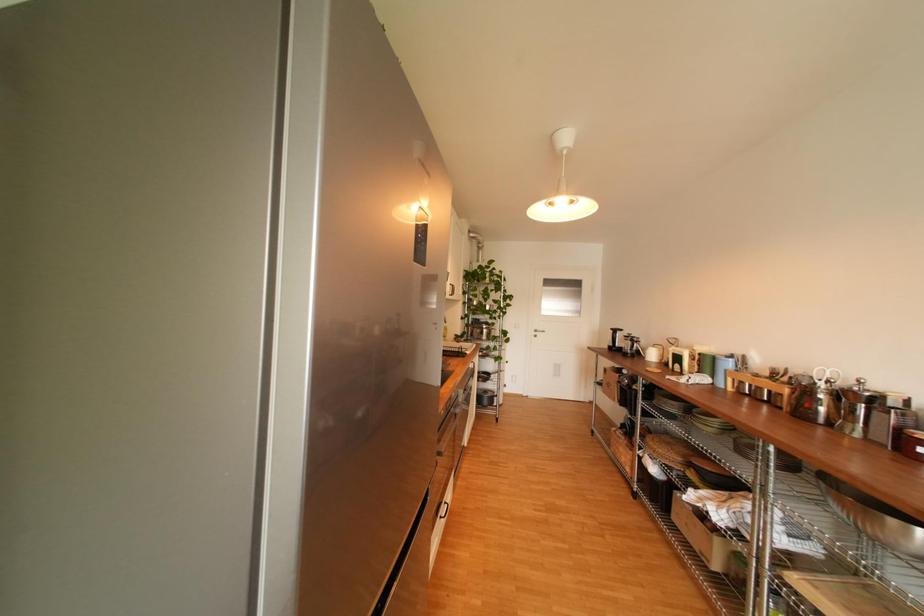
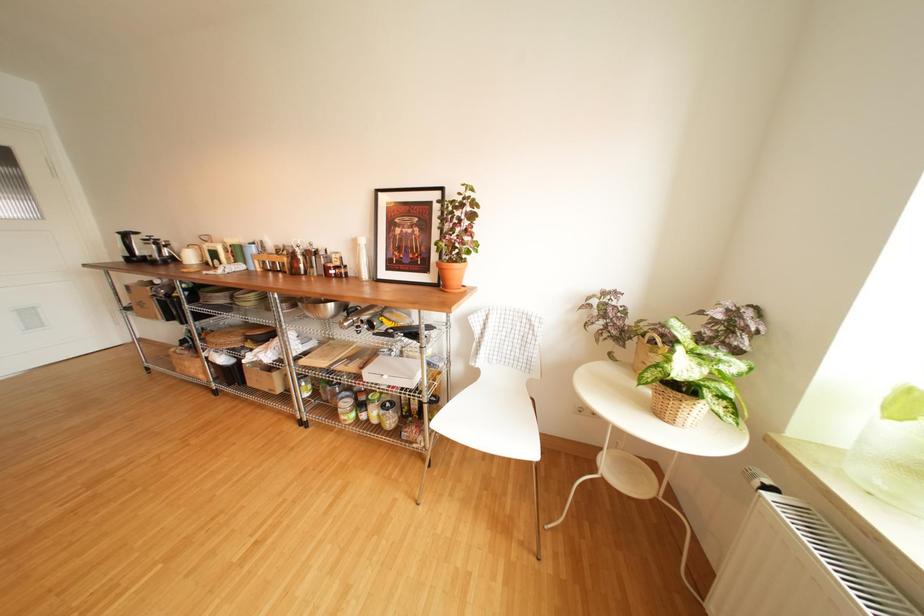
First-person continuous shooting, in which direction is the camera rotating?

The camera rotated toward right-down.